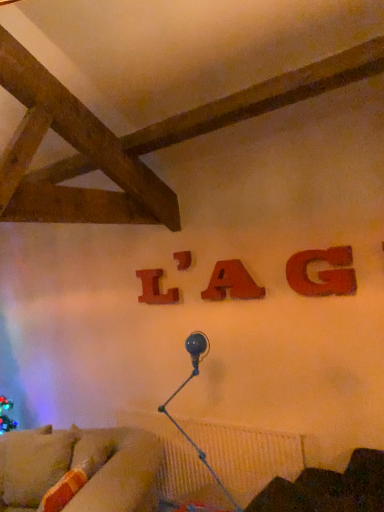
Image resolution: width=384 pixels, height=512 pixels. What are the coordinates of `velvet dark brown armchair at lower right` in the screenshot? It's located at (329, 488).

Describe the element at coordinates (329, 488) in the screenshot. This screenshot has width=384, height=512. I see `velvet dark brown armchair at lower right` at that location.

Locate an element on the screen. The image size is (384, 512). metallic blue lamp at lower center is located at coordinates (182, 388).

Measure the distance between point (251, 289) and camera.

Point (251, 289) is 2.44 meters from camera.

Where is `matte wood letter g at upper right, positioned as the first alphabet in front-to-back order`? matte wood letter g at upper right, positioned as the first alphabet in front-to-back order is located at coordinates (322, 272).

Based on the photo, from a real-world perspective, is velvet beige couch at lower left beneath wooden letter at center, which is counted as the third alphabet, starting from the front?

Yes.

From the image's perspective, would you say velvet beige couch at lower left is shown under wooden letter at center, which is counted as the third alphabet, starting from the front?

Yes, from the image's perspective, velvet beige couch at lower left is below wooden letter at center, which is counted as the third alphabet, starting from the front.

Considering the positions of point (46, 456) and point (180, 270), is point (46, 456) closer or farther from the camera than point (180, 270)?

Point (46, 456) appears to be closer to the viewer than point (180, 270).

This screenshot has height=512, width=384. Identify the location of furniture on the right side of wooden letter l at center, placed as the 4th alphabet when sorted from right to left. [x=329, y=488].

Between wooden letter l at center, placed as the 4th alphabet when sorted from right to left, and velvet dark brown armchair at lower right, which one has larger width?

velvet dark brown armchair at lower right.

Does wooden letter l at center, placed as the 4th alphabet when sorted from right to left, have a greater height compared to velvet dark brown armchair at lower right?

Incorrect, the height of wooden letter l at center, placed as the 4th alphabet when sorted from right to left, is not larger of that of velvet dark brown armchair at lower right.

How different are the orientations of wooden letter l at center, which is the 1th alphabet in left-to-right order, and velvet dark brown armchair at lower right in degrees?

39.4 degrees.

Between point (232, 289) and point (184, 384), which one is positioned in front?

The point (232, 289) is closer to the camera.

What's the angular difference between wooden letter a at center, which is counted as the second alphabet, starting from the front, and metallic blue lamp at lower center's facing directions?

wooden letter a at center, which is counted as the second alphabet, starting from the front, and metallic blue lamp at lower center are facing 0.000233 degrees away from each other.

Considering the relative positions of wooden letter a at center, the 3th alphabet positioned from the back, and metallic blue lamp at lower center in the image provided, is wooden letter a at center, the 3th alphabet positioned from the back, behind metallic blue lamp at lower center?

Yes, it is.

Is the surface of velvet dark brown armchair at lower right in direct contact with matte wood letter g at upper right, the 4th alphabet viewed from the left?

No, velvet dark brown armchair at lower right is not in contact with matte wood letter g at upper right, the 4th alphabet viewed from the left.

Identify the location of the 3rd alphabet positioned above the velvet dark brown armchair at lower right (from the image's perspective). [x=322, y=272].

In the image, is velvet dark brown armchair at lower right on the left side or the right side of matte wood letter g at upper right, placed as the 1th alphabet when sorted from right to left?

In the image, velvet dark brown armchair at lower right appears on the left side of matte wood letter g at upper right, placed as the 1th alphabet when sorted from right to left.

Which is correct: velvet dark brown armchair at lower right is inside matte wood letter g at upper right, the 4th alphabet viewed from the left, or outside of it?

velvet dark brown armchair at lower right lies outside matte wood letter g at upper right, the 4th alphabet viewed from the left.

From the image's perspective, is metallic blue lamp at lower center over wooden letter at center, the third alphabet viewed from the right?

Actually, metallic blue lamp at lower center appears below wooden letter at center, the third alphabet viewed from the right, in the image.

Does metallic blue lamp at lower center have a lesser height compared to wooden letter at center, which is counted as the third alphabet, starting from the front?

Incorrect, the height of metallic blue lamp at lower center does not fall short of that of wooden letter at center, which is counted as the third alphabet, starting from the front.

Between metallic blue lamp at lower center and wooden letter at center, the second alphabet positioned from the left, which one has larger width?

Wider between the two is metallic blue lamp at lower center.

Can you confirm if wooden letter l at center, which is the fourth alphabet from front to back, is smaller than velvet beige couch at lower left?

Yes.

Considering the positions of objects wooden letter l at center, which is the fourth alphabet from front to back, and velvet beige couch at lower left in the image provided, who is more to the right, wooden letter l at center, which is the fourth alphabet from front to back, or velvet beige couch at lower left?

From the viewer's perspective, wooden letter l at center, which is the fourth alphabet from front to back, appears more on the right side.

How different are the orientations of wooden letter l at center, which is the 1th alphabet in left-to-right order, and velvet beige couch at lower left in degrees?

The angle between the facing direction of wooden letter l at center, which is the 1th alphabet in left-to-right order, and the facing direction of velvet beige couch at lower left is 69.6 degrees.

Is point (149, 289) closer or farther from the camera than point (66, 465)?

Point (149, 289) appears to be farther away from the viewer than point (66, 465).

Who is bigger, wooden letter l at center, which is the fourth alphabet from front to back, or matte wood letter g at upper right, the 4th alphabet viewed from the left?

Bigger between the two is matte wood letter g at upper right, the 4th alphabet viewed from the left.

From the image's perspective, who appears lower, wooden letter l at center, placed as the 4th alphabet when sorted from right to left, or matte wood letter g at upper right, the fourth alphabet when ordered from back to front?

wooden letter l at center, placed as the 4th alphabet when sorted from right to left.

In the scene shown: From a real-world perspective, is wooden letter l at center, placed as the 4th alphabet when sorted from right to left, under matte wood letter g at upper right, the fourth alphabet when ordered from back to front?

No, from a real-world perspective, wooden letter l at center, placed as the 4th alphabet when sorted from right to left, is not beneath matte wood letter g at upper right, the fourth alphabet when ordered from back to front.

Where is `the 2nd alphabet positioned below the wooden letter l at center, placed as the 4th alphabet when sorted from right to left (from a real-world perspective)`? The width and height of the screenshot is (384, 512). the 2nd alphabet positioned below the wooden letter l at center, placed as the 4th alphabet when sorted from right to left (from a real-world perspective) is located at coordinates (322, 272).

The height and width of the screenshot is (512, 384). In order to click on studio couch below the wooden letter at center, the second alphabet positioned from the left (from a real-world perspective) in this screenshot , I will do `click(78, 463)`.

Where is `furniture on the right of wooden letter l at center, which is the fourth alphabet from front to back`? The height and width of the screenshot is (512, 384). furniture on the right of wooden letter l at center, which is the fourth alphabet from front to back is located at coordinates (329, 488).

Based on their spatial positions, is wooden letter at center, the third alphabet viewed from the right, or wooden letter a at center, which is counted as the second alphabet, starting from the front, further from wooden letter l at center, positioned as the 1th alphabet in back-to-front order?

Based on the image, wooden letter a at center, which is counted as the second alphabet, starting from the front, appears to be further to wooden letter l at center, positioned as the 1th alphabet in back-to-front order.

Looking at the image, which one is located further to metallic blue lamp at lower center, velvet beige couch at lower left or velvet dark brown armchair at lower right?

Based on the image, velvet dark brown armchair at lower right appears to be further to metallic blue lamp at lower center.

Considering their positions, is wooden letter a at center, the 2th alphabet from the right, positioned closer to matte wood letter g at upper right, positioned as the first alphabet in front-to-back order, than metallic blue lamp at lower center?

wooden letter a at center, the 2th alphabet from the right.

In the scene shown: Which object lies further to the anchor point velvet dark brown armchair at lower right, velvet beige couch at lower left or matte wood letter g at upper right, positioned as the first alphabet in front-to-back order?

velvet beige couch at lower left is positioned further to the anchor velvet dark brown armchair at lower right.

Based on their spatial positions, is velvet beige couch at lower left or velvet dark brown armchair at lower right closer to matte wood letter g at upper right, the fourth alphabet when ordered from back to front?

velvet dark brown armchair at lower right.

When comparing their distances from wooden letter at center, which is counted as the third alphabet, starting from the front, does velvet beige couch at lower left or wooden letter a at center, the 2th alphabet from the right, seem closer?

Based on the image, wooden letter a at center, the 2th alphabet from the right, appears to be nearer to wooden letter at center, which is counted as the third alphabet, starting from the front.

Which object lies nearer to the anchor point wooden letter at center, which is counted as the third alphabet, starting from the front, wooden letter a at center, which is counted as the second alphabet, starting from the front, or velvet beige couch at lower left?

wooden letter a at center, which is counted as the second alphabet, starting from the front, is positioned closer to the anchor wooden letter at center, which is counted as the third alphabet, starting from the front.

From the image, which object appears to be nearer to velvet beige couch at lower left, matte wood letter g at upper right, positioned as the first alphabet in front-to-back order, or metallic blue lamp at lower center?

Among the two, metallic blue lamp at lower center is located nearer to velvet beige couch at lower left.

Find the location of a particular element. The image size is (384, 512). lamp between matte wood letter g at upper right, positioned as the first alphabet in front-to-back order, and velvet dark brown armchair at lower right from top to bottom is located at coordinates (182, 388).

Locate an element on the screen. The height and width of the screenshot is (512, 384). lamp between wooden letter a at center, which is counted as the second alphabet, starting from the front, and velvet beige couch at lower left, in the vertical direction is located at coordinates (182, 388).

Where is `lamp between velvet beige couch at lower left and velvet dark brown armchair at lower right in the horizontal direction`? This screenshot has height=512, width=384. lamp between velvet beige couch at lower left and velvet dark brown armchair at lower right in the horizontal direction is located at coordinates (182, 388).

Image resolution: width=384 pixels, height=512 pixels. Find the location of `lamp located between velvet beige couch at lower left and matte wood letter g at upper right, the 4th alphabet viewed from the left, in the left-right direction`. lamp located between velvet beige couch at lower left and matte wood letter g at upper right, the 4th alphabet viewed from the left, in the left-right direction is located at coordinates (182, 388).